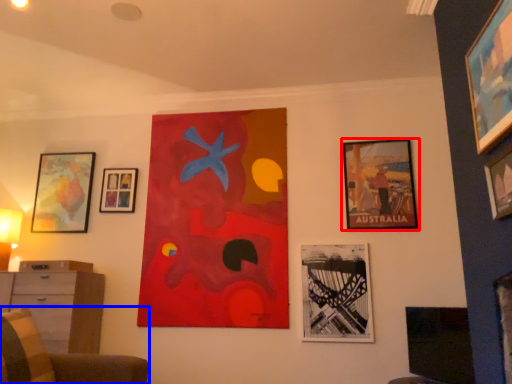
Question: Among these objects, which one is nearest to the camera, picture frame (highlighted by a red box) or furniture (highlighted by a blue box)?

Choices:
 (A) picture frame
 (B) furniture

Answer: (B)